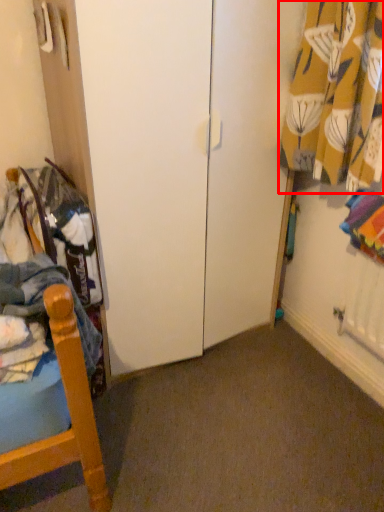
Question: Where is curtain (annotated by the red box) located in relation to clothing in the image?

Choices:
 (A) left
 (B) right

Answer: (B)